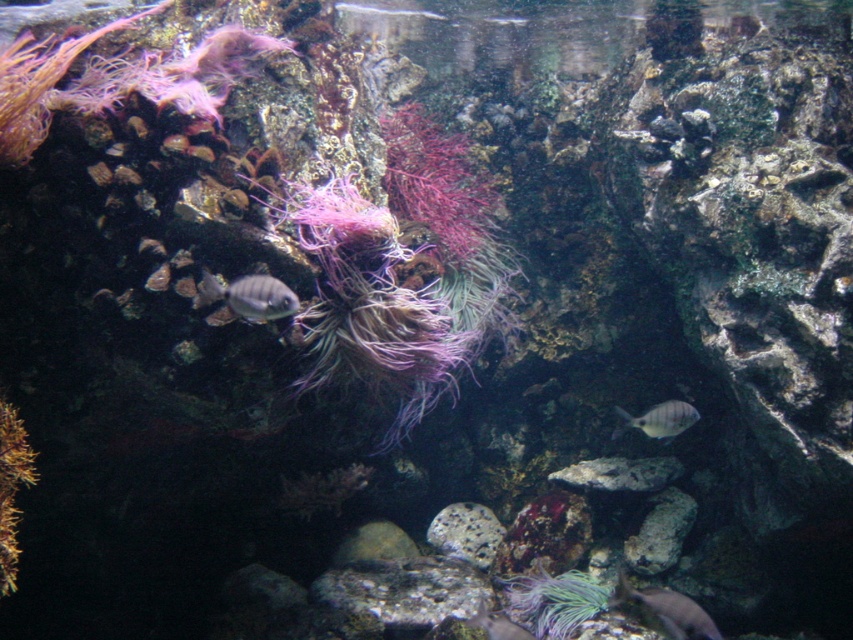
You are an underwater photographer aiming to capture both the purple soft coral at center and the silvery metallic fish at lower center in a single frame. Given their sizes, which object should you focus on first to ensure both fit in the shot?

The purple soft coral at center is wider than the silvery metallic fish at lower center. To ensure both fit in the shot, focus on framing the larger purple soft coral at center first, then position the smaller silvery metallic fish at lower center within the remaining space.

You are an underwater photographer aiming to capture the smooth gray rock at center. Based on the coordinates provided, where should you position your camera to ensure the rock is centered in your shot?

The smooth gray rock at center is located at coordinates 0.833 on the x axis and 0.775 on the y axis. To center it in your shot, position your camera so the crosshairs align with these coordinates.

You are a scuba diver swimming in the underwater scene. You notice the purple soft coral at center and the silvery metallic fish at lower center. Which object is nearer to you?

The purple soft coral at center is closer to the viewer than the silvery metallic fish at lower center, so the purple soft coral at center is nearer to you.